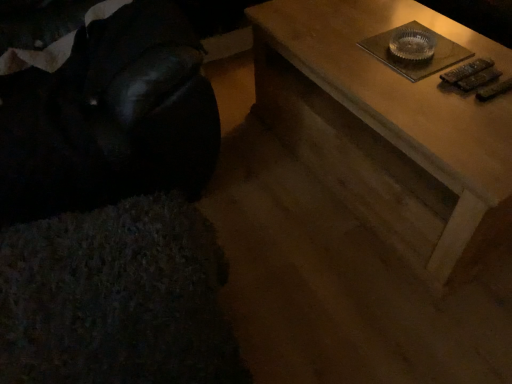
Find the location of a particular element. The width and height of the screenshot is (512, 384). free space to the left of wooden table at upper right is located at coordinates (265, 173).